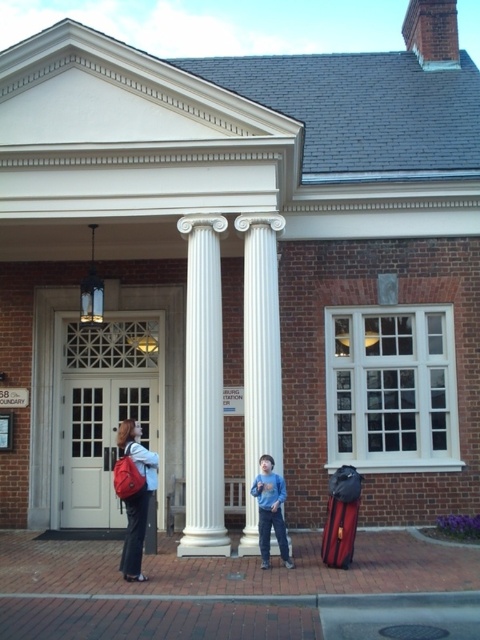
Question: Is matte red backpack at left above blue cotton shirt at center?

Choices:
 (A) yes
 (B) no

Answer: (A)

Question: Which point appears farthest from the camera in this image?

Choices:
 (A) (275, 392)
 (B) (268, 477)
 (C) (334, 497)

Answer: (A)

Question: Is matte red backpack at left closer to camera compared to blue cotton shirt at center?

Choices:
 (A) yes
 (B) no

Answer: (A)

Question: Can you confirm if white glossy column at center is smaller than white marble column at center?

Choices:
 (A) yes
 (B) no

Answer: (B)

Question: Among these points, which one is farthest from the camera?

Choices:
 (A) (84, 360)
 (B) (264, 376)
 (C) (222, 332)
 (D) (130, 552)

Answer: (A)

Question: Which of the following is the closest to the observer?

Choices:
 (A) (211, 321)
 (B) (126, 452)
 (C) (266, 566)
 (D) (245, 413)

Answer: (B)